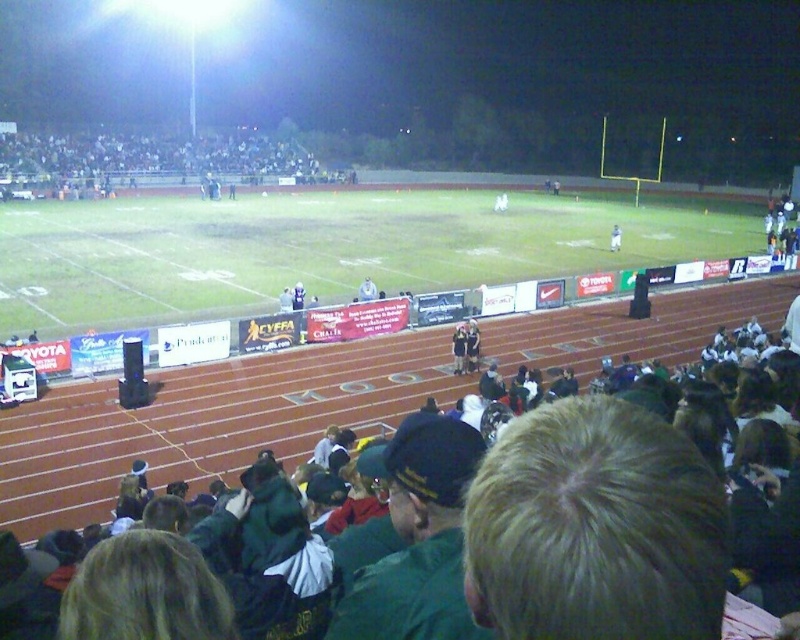
Can you confirm if dark green jacket at lower center is shorter than white plastic bag at center?

Indeed, dark green jacket at lower center has a lesser height compared to white plastic bag at center.

Is dark green jacket at lower center positioned in front of white plastic bag at center?

Yes, dark green jacket at lower center is closer to the viewer.

Does point (616, 499) come in front of point (616, 236)?

Yes, point (616, 499) is in front of point (616, 236).

The height and width of the screenshot is (640, 800). Find the location of `dark green jacket at lower center`. dark green jacket at lower center is located at coordinates (x=568, y=531).

Who is more forward, [628,630] or [54,180]?

Point [628,630] is in front.

Between point (458, 593) and point (88, 164), which one is positioned behind?

Point (88, 164)

Which is in front, point (666, 637) or point (188, 164)?

Point (666, 637)

Where is `dark green jacket at lower center`? dark green jacket at lower center is located at coordinates (568, 531).

Measure the distance between dark gray stadium seats at upper left and white plastic bag at center.

dark gray stadium seats at upper left is 64.99 meters from white plastic bag at center.

Who is higher up, dark gray stadium seats at upper left or white plastic bag at center?

Positioned higher is dark gray stadium seats at upper left.

The height and width of the screenshot is (640, 800). Describe the element at coordinates (158, 157) in the screenshot. I see `dark gray stadium seats at upper left` at that location.

Where is `dark gray stadium seats at upper left`? Image resolution: width=800 pixels, height=640 pixels. dark gray stadium seats at upper left is located at coordinates (158, 157).